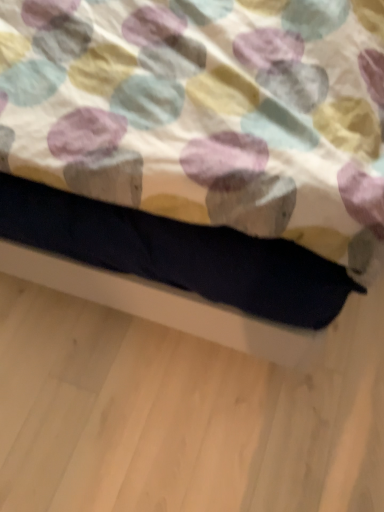
The height and width of the screenshot is (512, 384). Describe the element at coordinates (206, 113) in the screenshot. I see `white matte bed at center` at that location.

What is the approximate width of white matte bed at center?

The width of white matte bed at center is 1.65 meters.

Identify the location of white matte bed at center. (206, 113).

Locate an element on the screen. Image resolution: width=384 pixels, height=512 pixels. white matte bed at center is located at coordinates (206, 113).